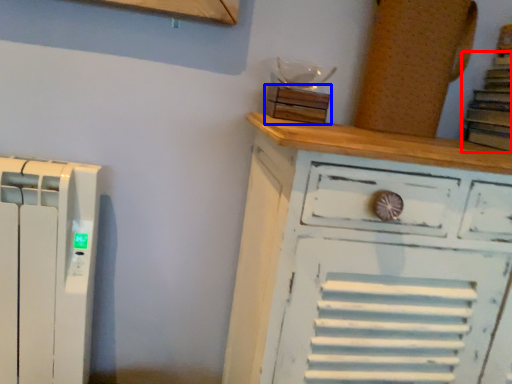
Question: Which point is closer to the camera, book (highlighted by a red box) or wood (highlighted by a blue box)?

Choices:
 (A) book
 (B) wood

Answer: (A)